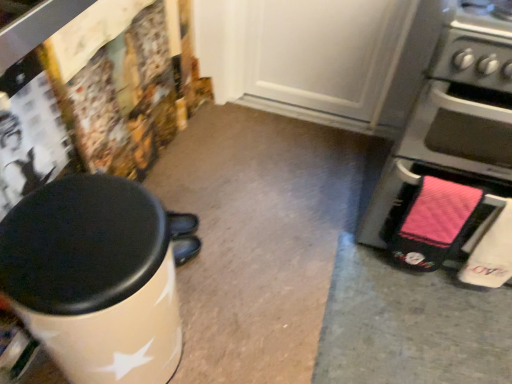
Question: Is point (499, 137) positioned closer to the camera than point (97, 235)?

Choices:
 (A) farther
 (B) closer

Answer: (A)

Question: In terms of size, does pink fabric oven at right appear bigger or smaller than white glossy waste container at left?

Choices:
 (A) big
 (B) small

Answer: (A)

Question: Which is correct: pink fabric oven at right is inside white glossy waste container at left, or outside of it?

Choices:
 (A) outside
 (B) inside

Answer: (A)

Question: Is white glossy waste container at left bigger or smaller than pink fabric oven at right?

Choices:
 (A) big
 (B) small

Answer: (B)

Question: In the image, is white glossy waste container at left positioned in front of or behind pink fabric oven at right?

Choices:
 (A) front
 (B) behind

Answer: (A)

Question: In terms of height, does white glossy waste container at left look taller or shorter compared to pink fabric oven at right?

Choices:
 (A) tall
 (B) short

Answer: (B)

Question: From a real-world perspective, is white glossy waste container at left physically located above or below pink fabric oven at right?

Choices:
 (A) below
 (B) above

Answer: (A)